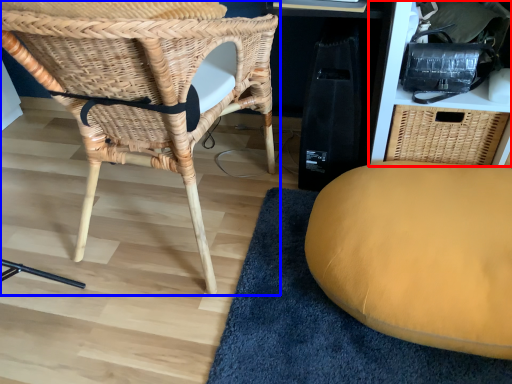
Question: Which object is further to the camera taking this photo, shelf (highlighted by a red box) or chair (highlighted by a blue box)?

Choices:
 (A) shelf
 (B) chair

Answer: (A)